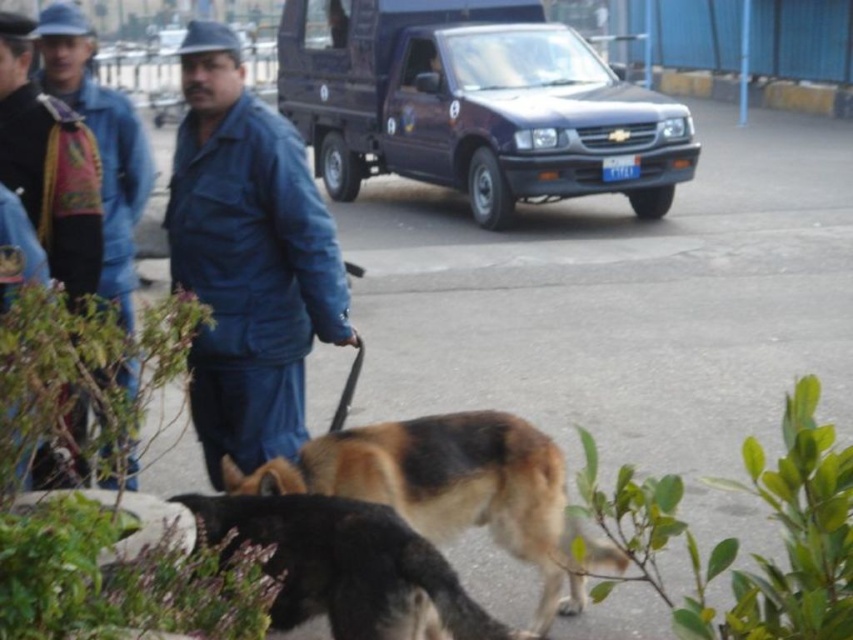
Question: Which object is farther from the camera taking this photo?

Choices:
 (A) blue denim jacket at center
 (B) metallic blue truck at upper center

Answer: (B)

Question: Which point is farther from the camera taking this photo?

Choices:
 (A) (366, 570)
 (B) (215, 264)

Answer: (B)

Question: Is brown fur dog at lower center positioned at the back of blue denim jacket at upper left?

Choices:
 (A) yes
 (B) no

Answer: (B)

Question: Is metallic blue truck at upper center behind blue denim jacket at center?

Choices:
 (A) yes
 (B) no

Answer: (A)

Question: Is brown fur dog at lower center thinner than blue denim jacket at upper left?

Choices:
 (A) no
 (B) yes

Answer: (A)

Question: Among these points, which one is nearest to the camera?

Choices:
 (A) (114, 275)
 (B) (653, 177)

Answer: (A)